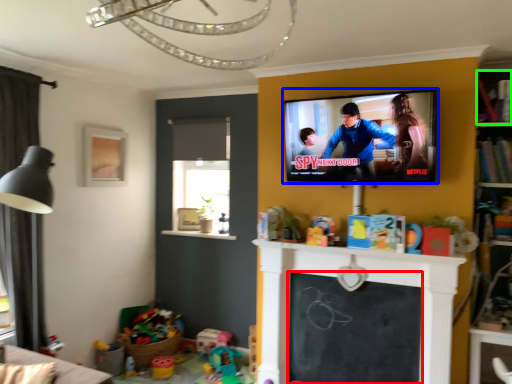
Question: Estimate the real-world distances between objects in this image. Which object is closer to screen (highlighted by a red box), television (highlighted by a blue box) or shelf (highlighted by a green box)?

Choices:
 (A) television
 (B) shelf

Answer: (A)